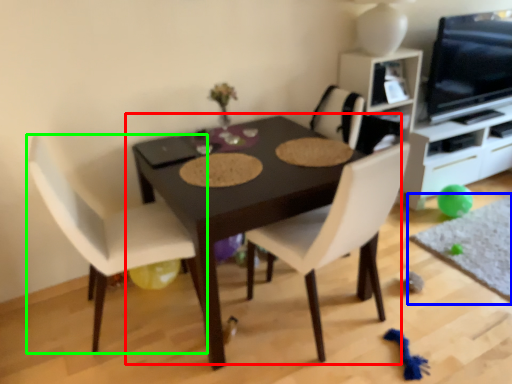
Question: Based on their relative distances, which object is farther from table (highlighted by a red box)? Choose from place mat (highlighted by a blue box) and chair (highlighted by a green box).

Choices:
 (A) place mat
 (B) chair

Answer: (A)